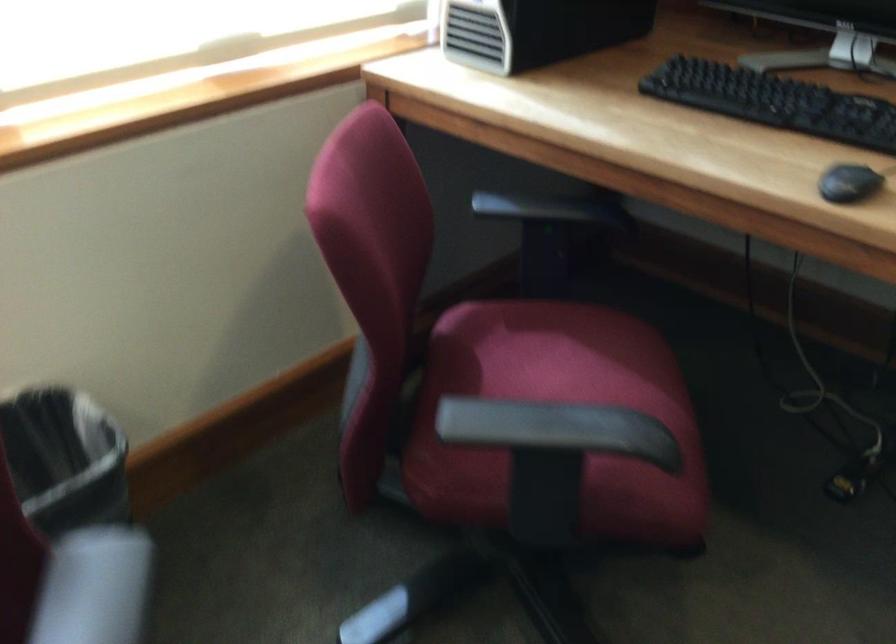
Identify the location of red chair sitting surface. This screenshot has width=896, height=644. (556, 415).